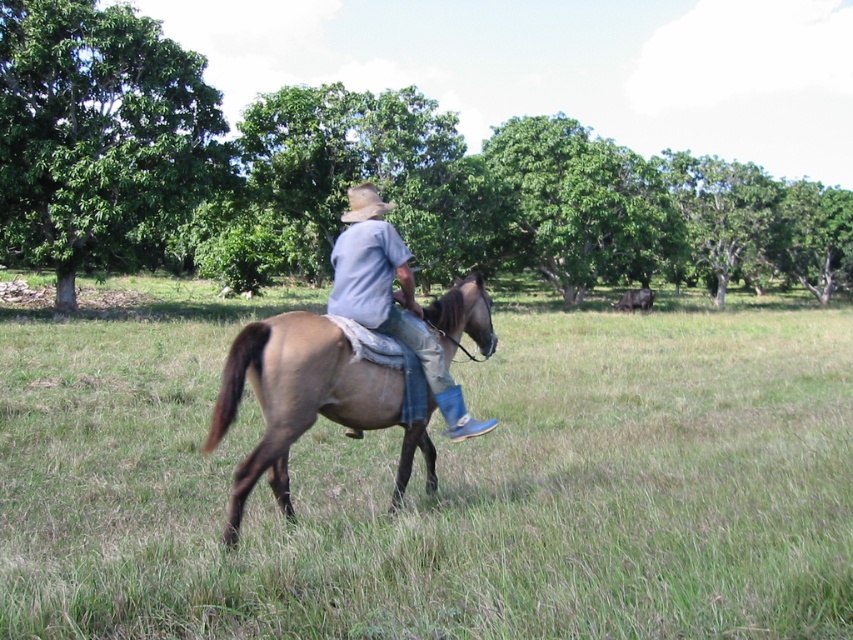
Between brown leather horse at center and brown matte/suede horse at center, which one appears on the right side from the viewer's perspective?

brown matte/suede horse at center is more to the right.

Is brown leather horse at center below brown matte/suede horse at center?

Incorrect, brown leather horse at center is not positioned below brown matte/suede horse at center.

Is point (849, 438) positioned in front of point (291, 419)?

No.

What are the coordinates of `brown leather horse at center` in the screenshot? It's located at (438, 483).

Which is below, brown matte/suede horse at center or denim jeans at center?

Positioned lower is denim jeans at center.

Is brown matte/suede horse at center to the right of denim jeans at center from the viewer's perspective?

No, brown matte/suede horse at center is not to the right of denim jeans at center.

Is point (328, 324) positioned in front of point (399, 292)?

Yes, it is.

Find the location of a particular element. brown matte/suede horse at center is located at coordinates (296, 396).

Is denim jeans at center positioned at the back of brown felt cowboy hat at center?

No, denim jeans at center is closer to the viewer.

What do you see at coordinates (392, 300) in the screenshot?
I see `denim jeans at center` at bounding box center [392, 300].

In order to click on denim jeans at center in this screenshot , I will do `click(392, 300)`.